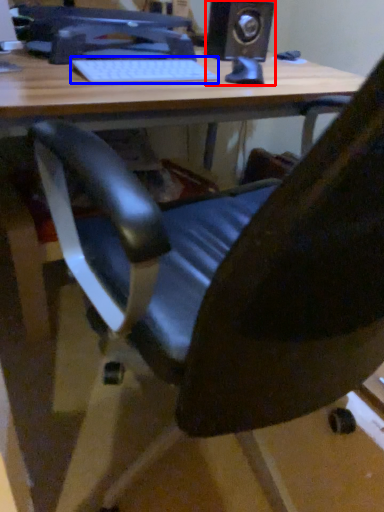
Question: Which point is closer to the camera, speaker (highlighted by a red box) or laptop keyboard (highlighted by a blue box)?

Choices:
 (A) speaker
 (B) laptop keyboard

Answer: (B)